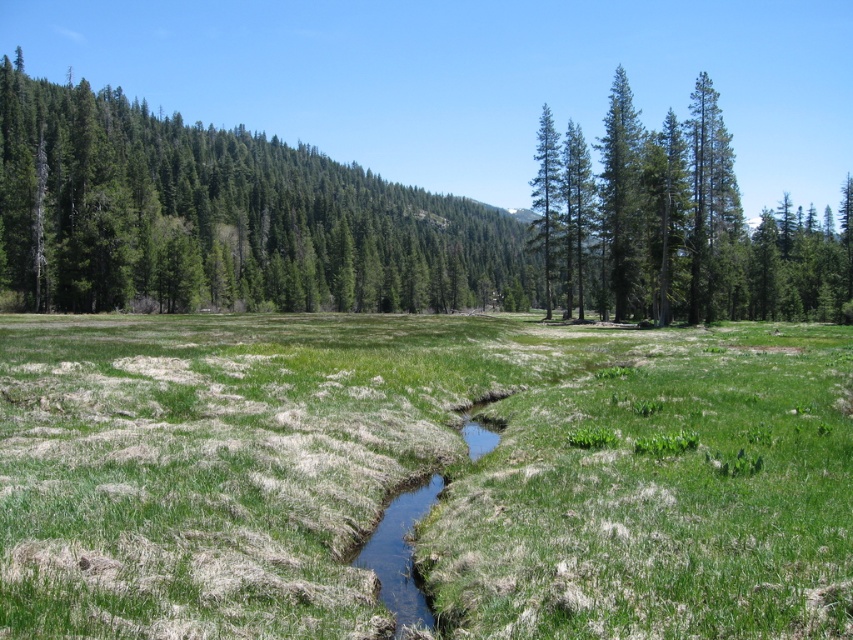
You are standing in the middle of the field looking towards the forest. There are two points marked in the image. Which point, point (410, 580) or point (543, 221), is closer to you?

Point (410, 580) is closer to you than point (543, 221).

You are a hiker standing at the edge of the field looking towards the forest. You see the clear water stream at center and the green matte tree at center. Which object is closer to your left side?

The clear water stream at center is to the left of the green matte tree at center, so it is closer to your left side.